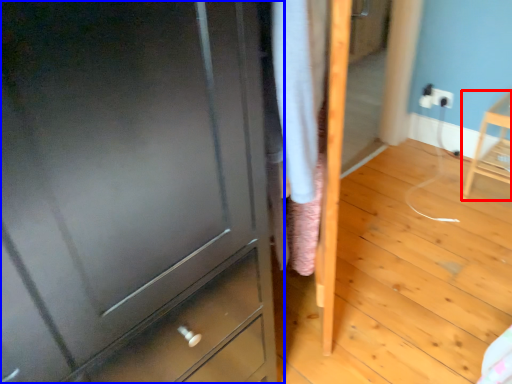
Question: Which of the following is the closest to the observer, furniture (highlighted by a red box) or chest of drawers (highlighted by a blue box)?

Choices:
 (A) furniture
 (B) chest of drawers

Answer: (B)